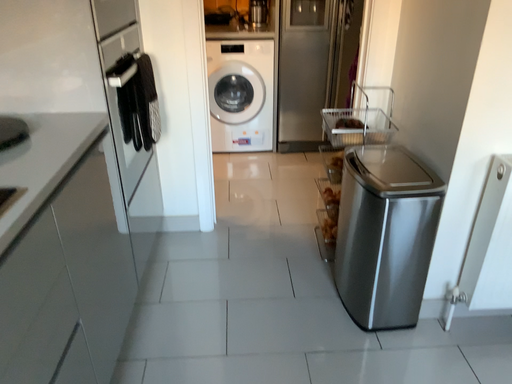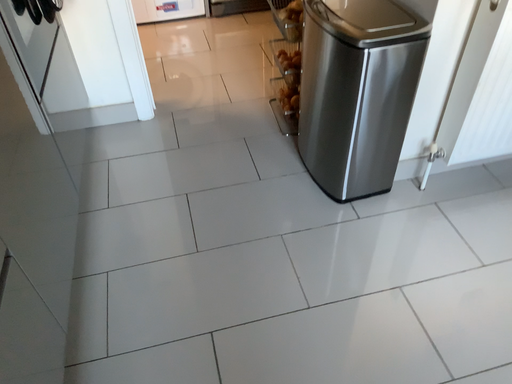
Question: How did the camera likely rotate when shooting the video?

Choices:
 (A) rotated right
 (B) rotated left

Answer: (A)